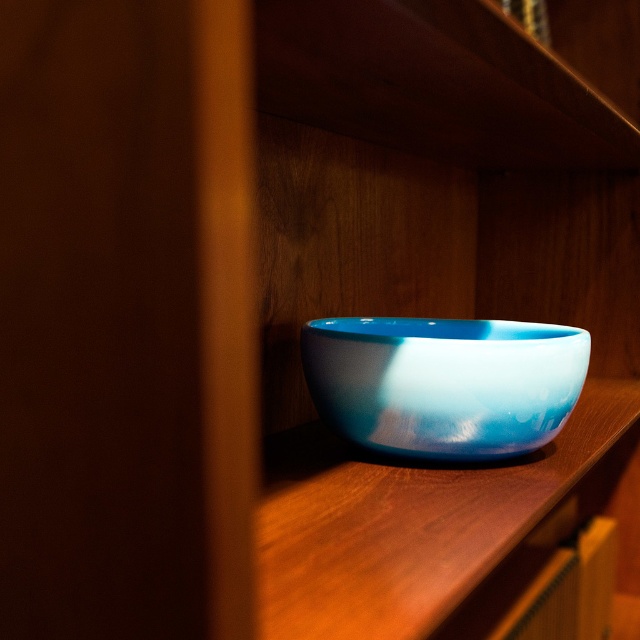
You are arranging items on a shelf and want to place a 6 inch wide decorative plate between the blue glossy bowl at center and the glossy ceramic bowl at center. Is there enough space between them to fit the plate?

The blue glossy bowl at center is 5.35 inches away from the glossy ceramic bowl at center. Since the plate is 6 inches wide, there isn not enough space between them to fit the plate.

You are an interior designer arranging items on a shelf. You have two bowls to place side by side. The blue glossy bowl at center and the glossy ceramic bowl at center. Which bowl should you place on the wider shelf space to accommodate its size?

The blue glossy bowl at center should be placed on the wider shelf space because its width is larger than the glossy ceramic bowl at center.

You are an interior designer arranging items on a shelf. You have two bowls to place here. The blue glossy bowl at center and the glossy ceramic bowl at center. Which one should you place first if you want to ensure there is enough space for both?

The blue glossy bowl at center is larger than the glossy ceramic bowl at center, so you should place the blue glossy bowl at center first to ensure there is enough space for both.